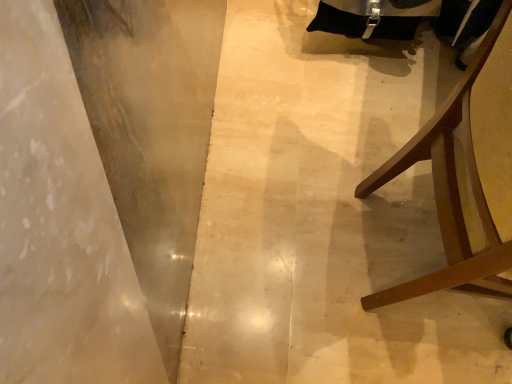
Question: From a real-world perspective, is smooth concrete at left positioned over brown wood chair at right based on gravity?

Choices:
 (A) no
 (B) yes

Answer: (A)

Question: Are smooth concrete at left and brown wood chair at right far apart?

Choices:
 (A) no
 (B) yes

Answer: (A)

Question: Would you say smooth concrete at left contains brown wood chair at right?

Choices:
 (A) no
 (B) yes

Answer: (A)

Question: Is smooth concrete at left bigger than brown wood chair at right?

Choices:
 (A) no
 (B) yes

Answer: (A)

Question: Does smooth concrete at left have a greater height compared to brown wood chair at right?

Choices:
 (A) yes
 (B) no

Answer: (B)

Question: Considering the relative sizes of smooth concrete at left and brown wood chair at right in the image provided, is smooth concrete at left thinner than brown wood chair at right?

Choices:
 (A) no
 (B) yes

Answer: (A)

Question: From a real-world perspective, does brown wood chair at right stand above smooth concrete at left?

Choices:
 (A) yes
 (B) no

Answer: (A)

Question: Can you confirm if brown wood chair at right is smaller than smooth concrete at left?

Choices:
 (A) yes
 (B) no

Answer: (B)

Question: Considering the relative sizes of brown wood chair at right and smooth concrete at left in the image provided, is brown wood chair at right bigger than smooth concrete at left?

Choices:
 (A) no
 (B) yes

Answer: (B)

Question: Can you confirm if brown wood chair at right is wider than smooth concrete at left?

Choices:
 (A) no
 (B) yes

Answer: (A)

Question: Is brown wood chair at right far away from smooth concrete at left?

Choices:
 (A) no
 (B) yes

Answer: (A)

Question: Considering the relative sizes of brown wood chair at right and smooth concrete at left in the image provided, is brown wood chair at right taller than smooth concrete at left?

Choices:
 (A) yes
 (B) no

Answer: (A)

Question: Is point (398, 350) positioned closer to the camera than point (477, 140)?

Choices:
 (A) farther
 (B) closer

Answer: (A)